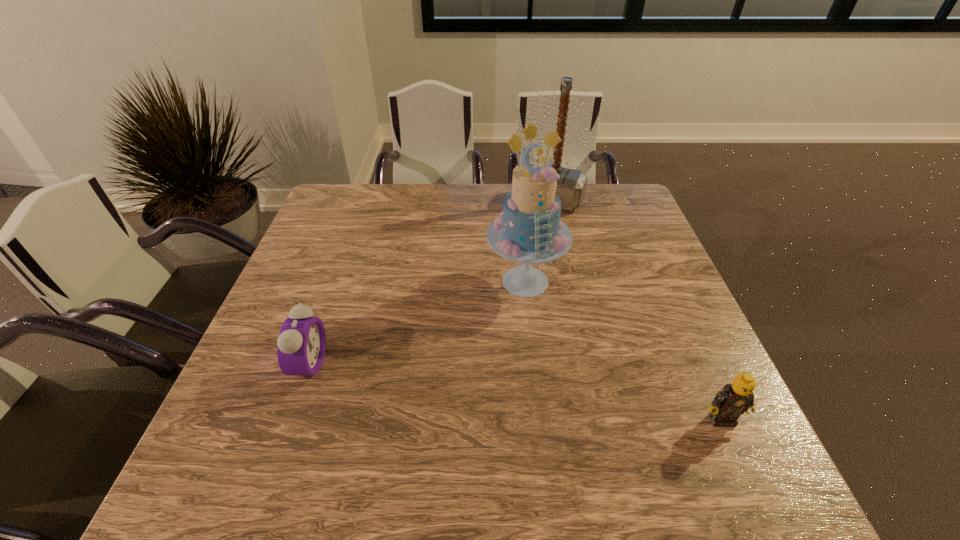
Where is `vacant space at the left edge of the desktop`? vacant space at the left edge of the desktop is located at coordinates (248, 361).

In order to click on vacant space at the right edge in this screenshot , I will do `click(689, 322)`.

Identify the location of vacant region at the far left corner. The height and width of the screenshot is (540, 960). (358, 213).

Image resolution: width=960 pixels, height=540 pixels. In order to click on vacant space at the near left corner of the desktop in this screenshot , I will do `click(241, 422)`.

Where is `free location at the far right corner`? free location at the far right corner is located at coordinates (593, 190).

I want to click on blank region between the nearest object and the cake, so click(623, 350).

Find the location of a particular element. The height and width of the screenshot is (540, 960). empty space between the cake and the rightmost object is located at coordinates (623, 350).

Find the location of a particular element. The width and height of the screenshot is (960, 540). empty space that is in between the hammer and the nearest object is located at coordinates (636, 310).

Where is `blank region between the rightmost object and the leftmost object`? blank region between the rightmost object and the leftmost object is located at coordinates (516, 392).

At what (x,y) coordinates should I click in order to perform the action: click on vacant point located between the hammer and the rightmost object. Please return your answer as a coordinate pair (x, y). Image resolution: width=960 pixels, height=540 pixels. Looking at the image, I should click on (636, 310).